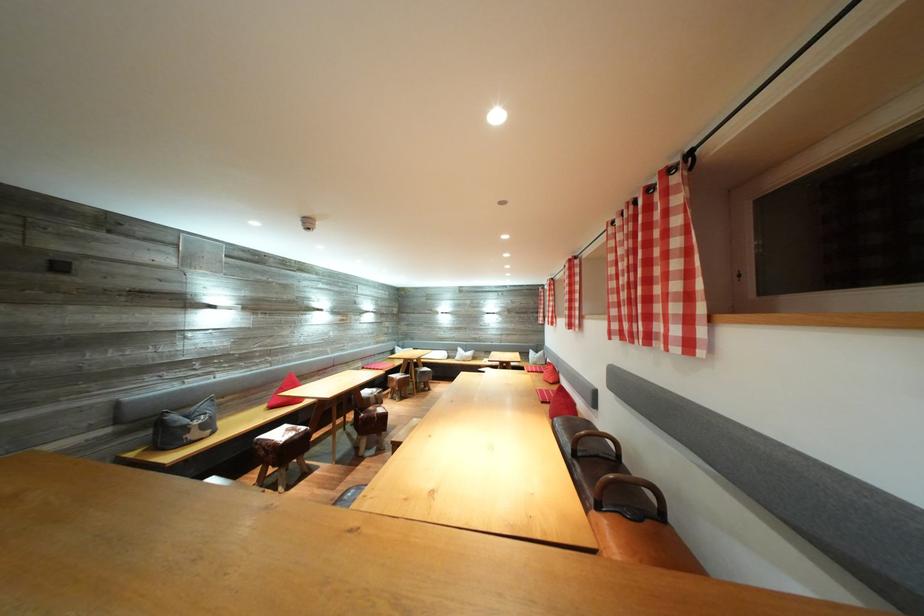
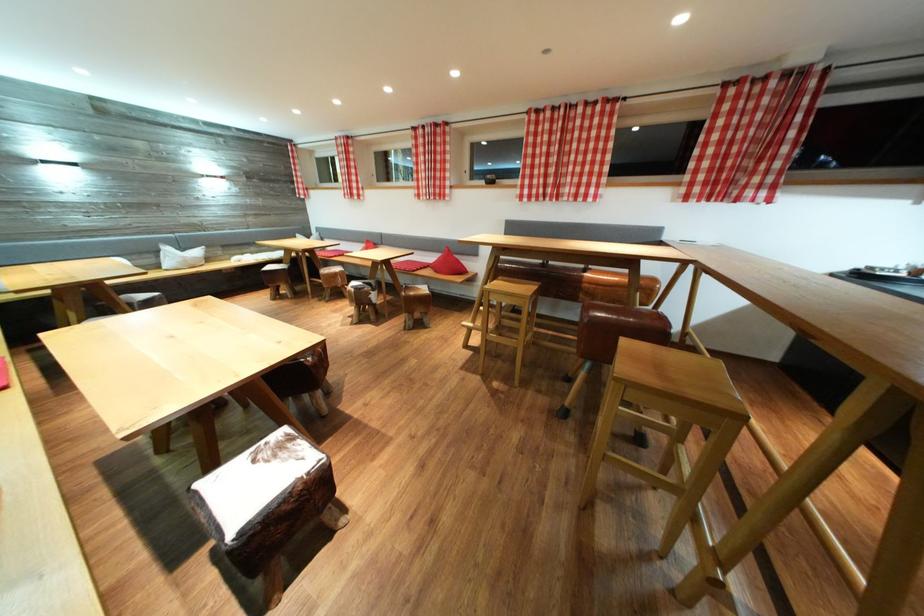
Locate, in the second image, the point that corresponds to pixel 458 357 in the first image.

(151, 259)